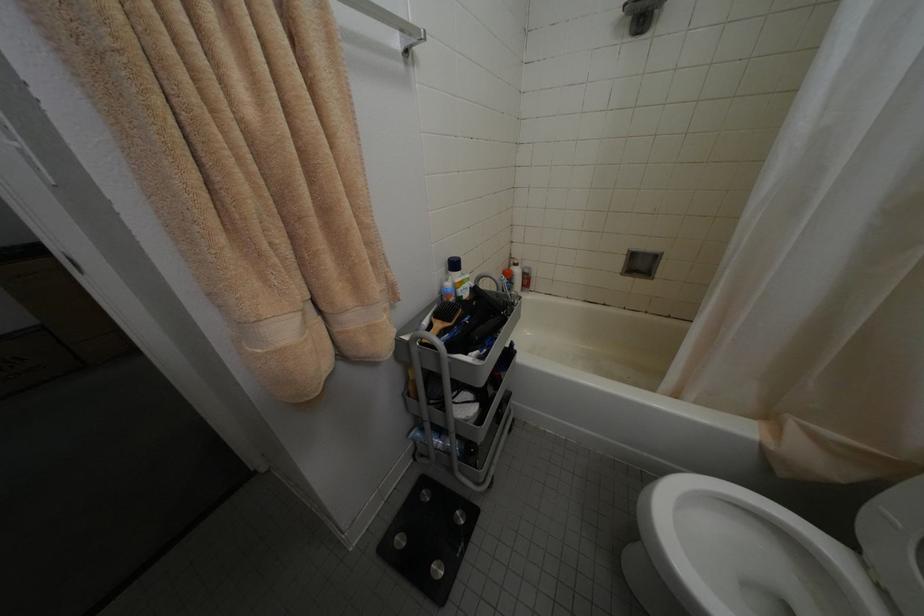
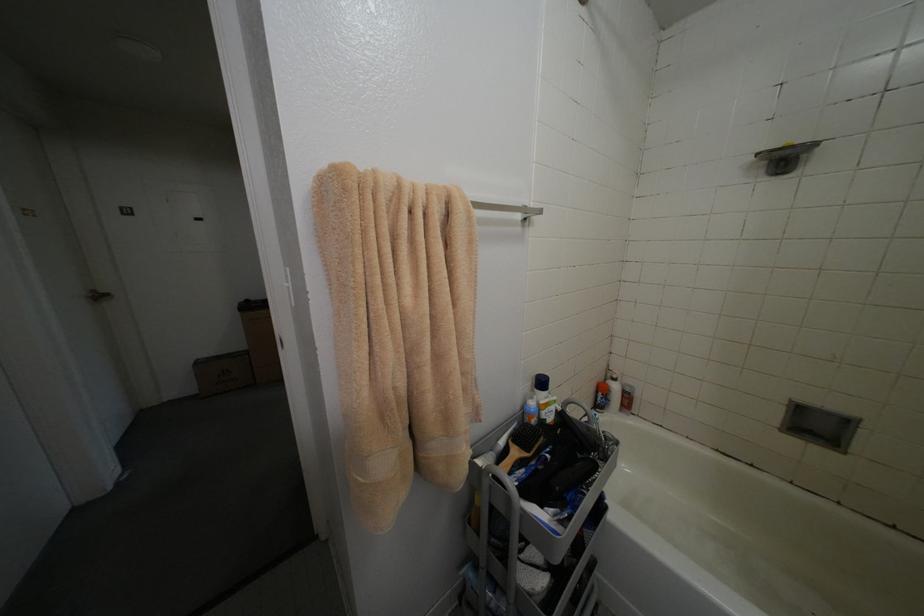
Question: The first image is from the beginning of the video and the second image is from the end. How did the camera likely rotate when shooting the video?

Choices:
 (A) Left
 (B) Right
 (C) Up
 (D) Down

Answer: (A)